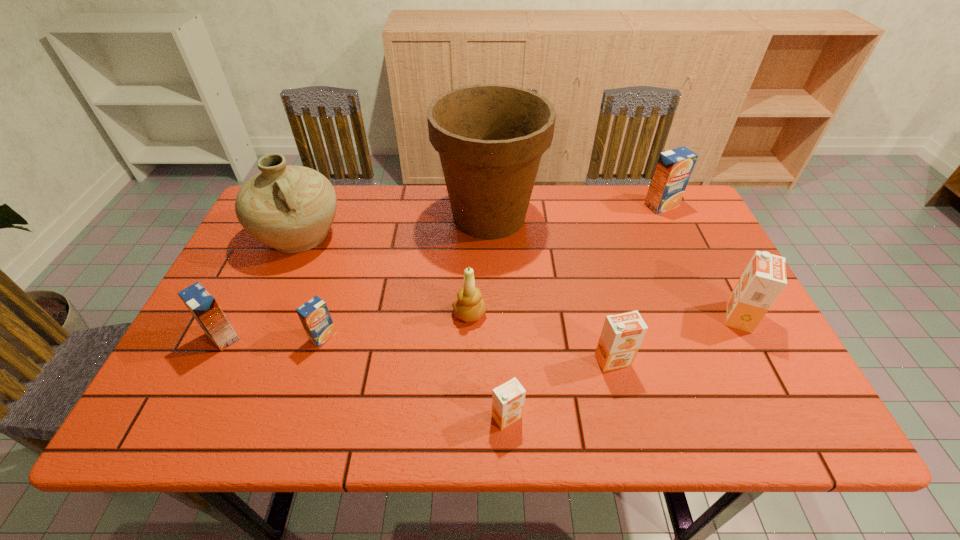
Identify the location of the second smallest orange orange juice. (622, 334).

At what (x,y) coordinates should I click in order to perform the action: click on the fifth orange juice from right to left. Please return your answer as a coordinate pair (x, y). Looking at the image, I should click on pyautogui.click(x=314, y=315).

Where is `the smallest blue orange_juice`? The image size is (960, 540). the smallest blue orange_juice is located at coordinates (314, 315).

Find the location of a particular element. the leftmost orange orange juice is located at coordinates (508, 399).

Locate an element on the screen. the fourth orange juice from right to left is located at coordinates (508, 399).

Find the location of `vacant space situated on the front of the tallest object`. vacant space situated on the front of the tallest object is located at coordinates [492, 299].

Where is `free space located 0.320m on the front of the second tallest object`? free space located 0.320m on the front of the second tallest object is located at coordinates (241, 370).

The image size is (960, 540). I want to click on free space located 0.350m on the left of the farthest blue orange_juice, so click(531, 206).

Identify the location of vacant space located on the left of the rightmost orange orange juice. The height and width of the screenshot is (540, 960). (621, 316).

I want to click on free space located 0.380m on the left of the candle_holder, so click(x=296, y=313).